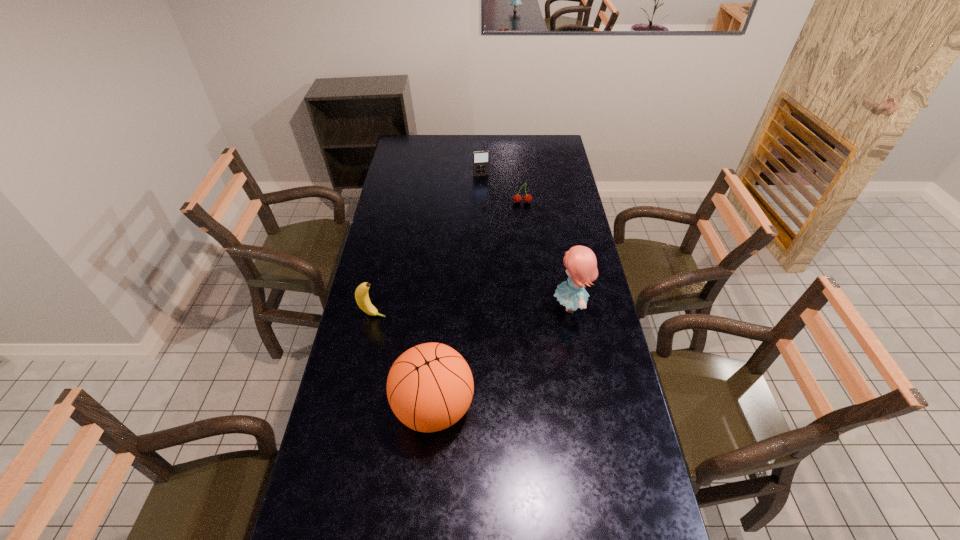
This screenshot has height=540, width=960. What are the coordinates of `vacant position located 0.140m on the front-facing side of the second shortest object` in the screenshot? It's located at (487, 192).

You are a GUI agent. You are given a task and a screenshot of the screen. Output one action in this format:
    pyautogui.click(x=<x>, y=<y>)
    Task: Click on the vacant space located 0.290m on the front-facing side of the second shortest object
    The width and height of the screenshot is (960, 540).
    Given the screenshot: What is the action you would take?
    pyautogui.click(x=492, y=212)

The width and height of the screenshot is (960, 540). Identify the location of object that is at the left edge. (361, 294).

Where is `object at the right edge`? The image size is (960, 540). object at the right edge is located at coordinates (581, 265).

The width and height of the screenshot is (960, 540). In the image, there is a desktop. Find the location of `vacant space at the left edge`. vacant space at the left edge is located at coordinates (413, 211).

The height and width of the screenshot is (540, 960). In the image, there is a desktop. In order to click on vacant region at the right edge in this screenshot , I will do pos(566,208).

Locate an element on the screen. blank space at the far left corner of the desktop is located at coordinates (398, 141).

Identify the location of vacant region at the far right corner of the desktop. The width and height of the screenshot is (960, 540). (565, 157).

I want to click on unoccupied area between the fourth shortest object and the rightmost object, so click(502, 357).

Where is `free spot between the leftmost object and the fourth tallest object`? The height and width of the screenshot is (540, 960). free spot between the leftmost object and the fourth tallest object is located at coordinates (427, 245).